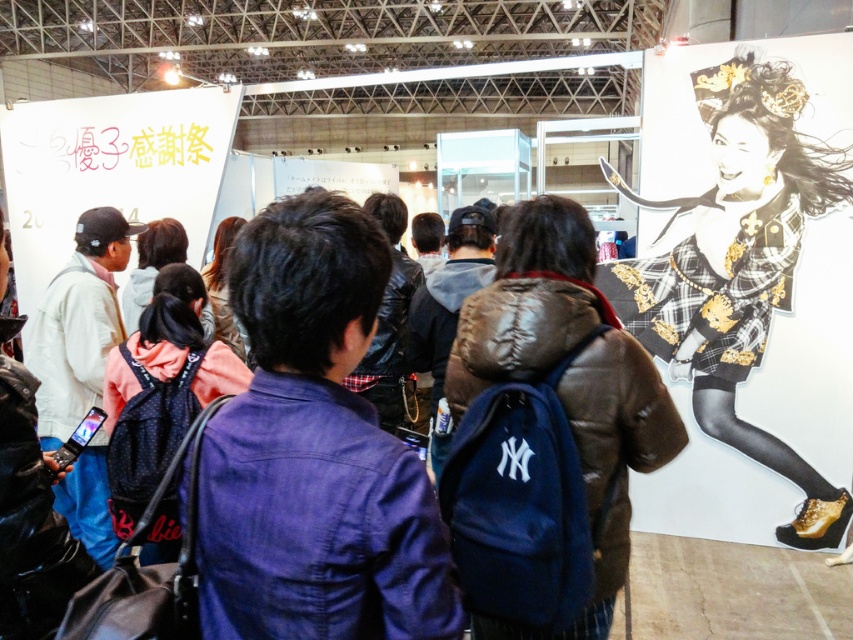
Question: Considering the relative positions of denim jacket at center and matte brown jacket at center in the image provided, where is denim jacket at center located with respect to matte brown jacket at center?

Choices:
 (A) left
 (B) right

Answer: (A)

Question: Among these points, which one is farthest from the camera?

Choices:
 (A) (374, 556)
 (B) (498, 252)

Answer: (B)

Question: Does denim jacket at center come behind matte brown jacket at center?

Choices:
 (A) yes
 (B) no

Answer: (B)

Question: Can you confirm if denim jacket at center is positioned to the right of matte brown jacket at center?

Choices:
 (A) no
 (B) yes

Answer: (A)